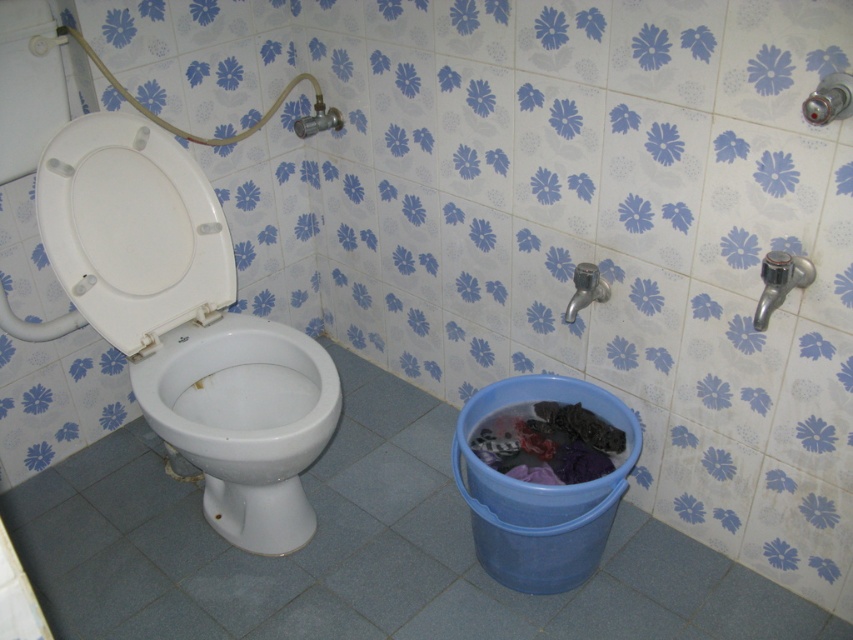
Question: Can you confirm if white plastic toilet seat at left is wider than white glossy toilet bowl at left?

Choices:
 (A) yes
 (B) no

Answer: (B)

Question: Is white glossy toilet bowl at left smaller than dark fabric laundry at lower right?

Choices:
 (A) yes
 (B) no

Answer: (B)

Question: Which object appears farthest from the camera in this image?

Choices:
 (A) white glossy toilet bowl at left
 (B) dark fabric laundry at lower right

Answer: (B)

Question: Which point is closer to the camera?

Choices:
 (A) white plastic toilet seat at left
 (B) white glossy toilet bowl at left
 (C) dark fabric laundry at lower right

Answer: (B)

Question: From the image, what is the correct spatial relationship of white plastic toilet seat at left in relation to dark fabric laundry at lower right?

Choices:
 (A) right
 (B) left

Answer: (B)

Question: Which point is closer to the camera?

Choices:
 (A) (100, 292)
 (B) (479, 426)
 (C) (282, 452)

Answer: (C)